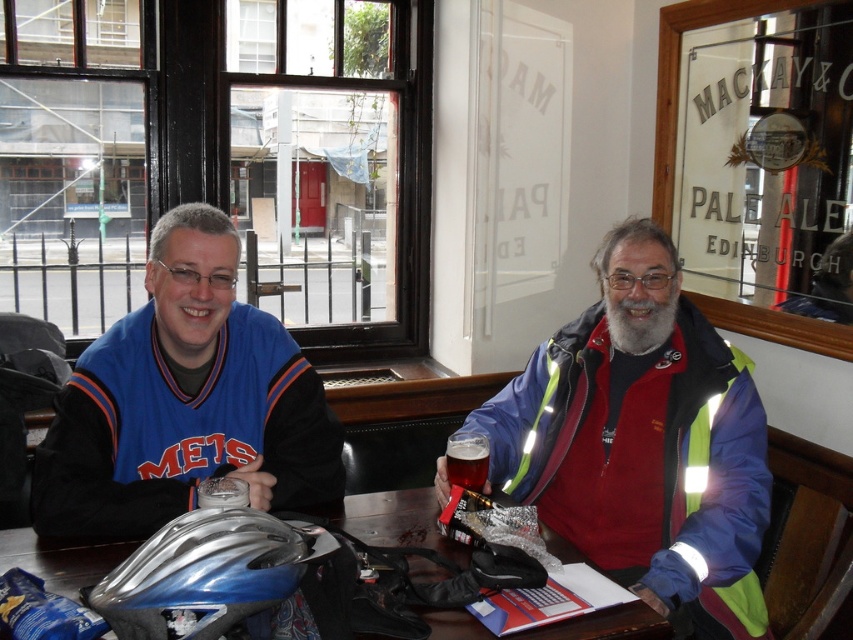
You are a photographer taking a picture of the blue jersey at center and the metallic blue helmet at center. Which object should you focus on first if you want to capture both clearly in your shot?

The blue jersey at center is above the metallic blue helmet at center, so focusing on the blue jersey at center first would ensure both are in clear focus as you adjust the camera.